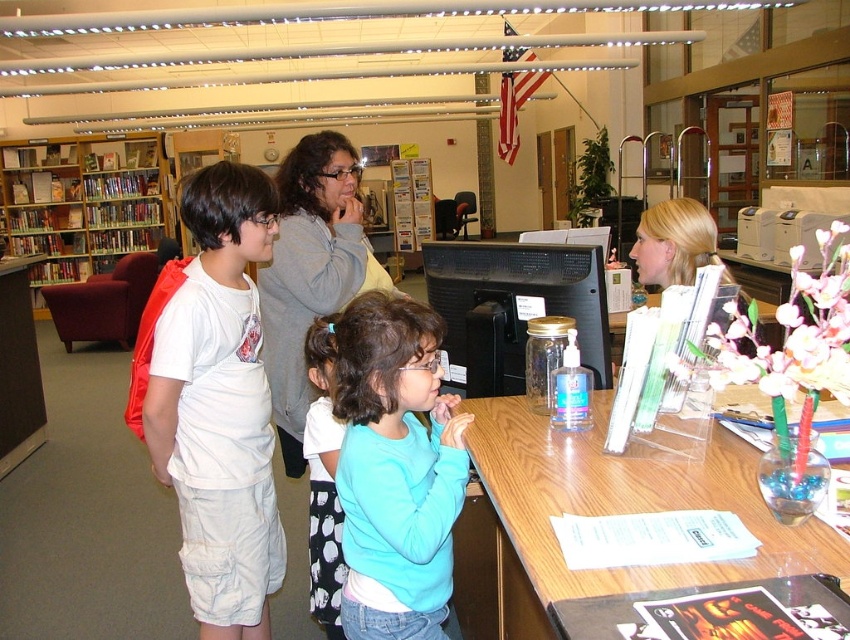
Question: Which point is closer to the camera?

Choices:
 (A) (310, 291)
 (B) (143, 150)
 (C) (659, 262)
 (D) (357, 515)

Answer: (D)

Question: Is white cotton shirt at left positioned in front of light blue sweater at center?

Choices:
 (A) yes
 (B) no

Answer: (B)

Question: Is wooden bookshelf at left below blue fabric skirt at lower center?

Choices:
 (A) yes
 (B) no

Answer: (B)

Question: In this image, where is white cotton shirt at left located relative to wooden table at lower center?

Choices:
 (A) left
 (B) right

Answer: (A)

Question: Which point is closer to the camera?

Choices:
 (A) (446, 580)
 (B) (646, 232)
 (C) (174, 486)

Answer: (A)

Question: Which point appears closest to the camera in this image?

Choices:
 (A) (714, 486)
 (B) (684, 212)
 (C) (295, 145)

Answer: (A)